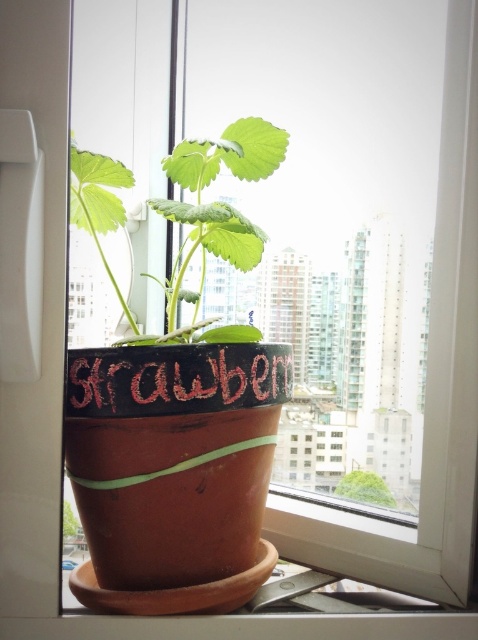
Who is more forward, (265, 166) or (390, 499)?

Point (265, 166) is in front.

Can you confirm if green matte leafy plant at center is taller than green matte pot at center?

Yes.

Is point (76, 180) in front of point (340, 492)?

Yes, point (76, 180) is in front of point (340, 492).

The image size is (478, 640). Identify the location of green matte leafy plant at center. pyautogui.click(x=183, y=209).

Who is shorter, chalky black sign at center or green matte pot at center?

green matte pot at center

Describe the element at coordinates (175, 378) in the screenshot. The image size is (478, 640). I see `chalky black sign at center` at that location.

Identify the location of chalky black sign at center. The image size is (478, 640). (175, 378).

The height and width of the screenshot is (640, 478). I want to click on chalky black sign at center, so click(x=175, y=378).

Looking at this image, which of these two, green matte leafy plant at center or chalky black sign at center, stands taller?

Standing taller between the two is green matte leafy plant at center.

Is point (110, 202) positioned after point (239, 365)?

Yes, point (110, 202) is behind point (239, 365).

Does point (259, 168) come closer to viewer compared to point (69, 413)?

No, it is behind (69, 413).

This screenshot has height=640, width=478. I want to click on green matte leafy plant at center, so click(x=183, y=209).